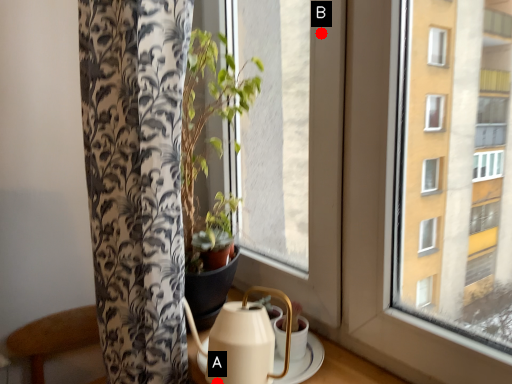
Question: Two points are circled on the image, labeled by A and B beside each circle. Which point is farther from the camera taking this photo?

Choices:
 (A) A is further
 (B) B is further

Answer: (B)